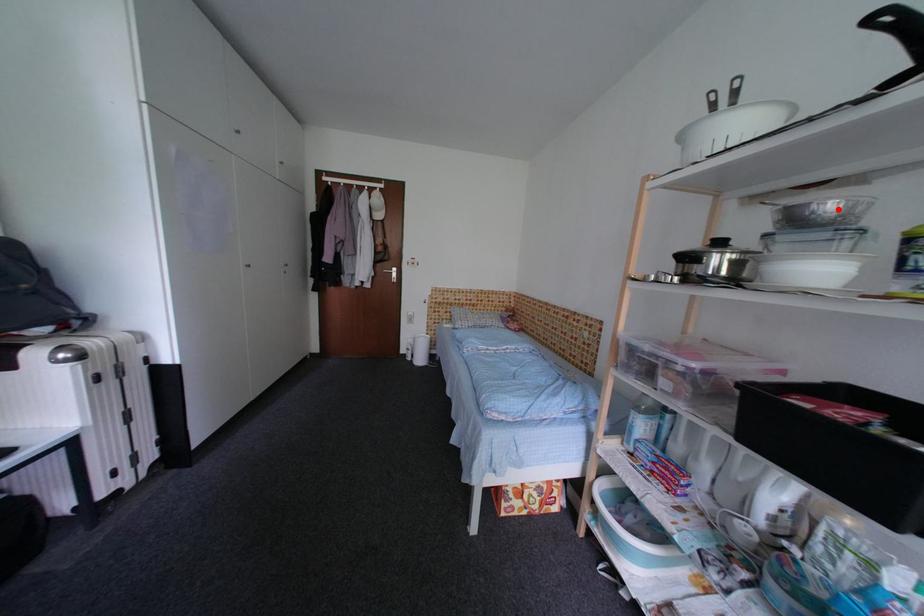
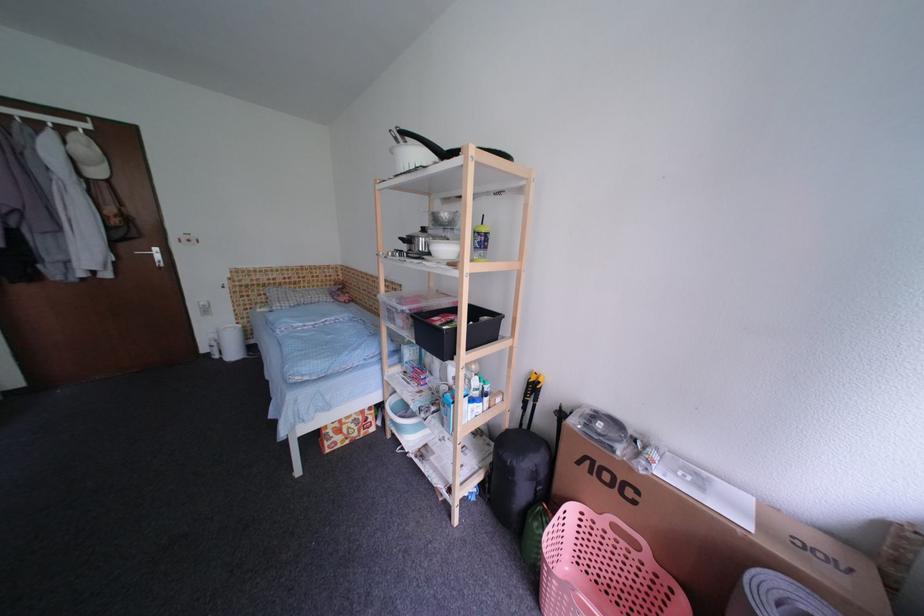
Locate, in the second image, the point that corresponds to the highlighted location in the first image.

(453, 217)